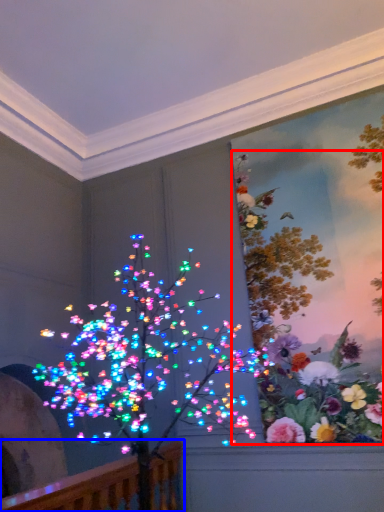
Question: Which object appears farthest to the camera in this image, floral arrangement (highlighted by a red box) or rail (highlighted by a blue box)?

Choices:
 (A) floral arrangement
 (B) rail

Answer: (A)